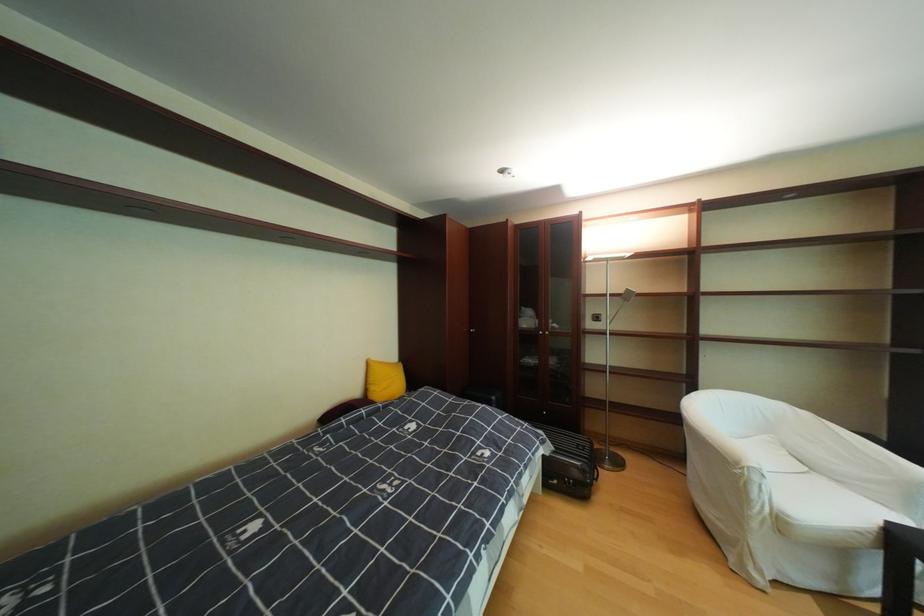
The height and width of the screenshot is (616, 924). Identify the location of white sofa armrest. (740, 418).